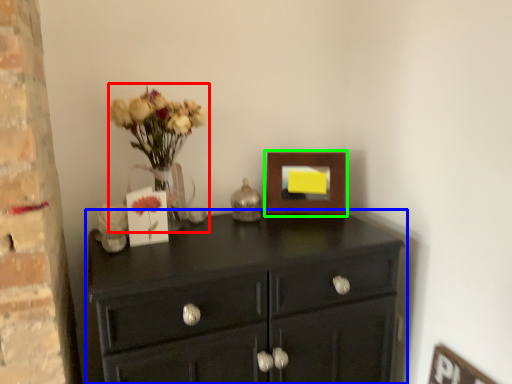
Question: Estimate the real-world distances between objects in this image. Which object is closer to floral arrangement (highlighted by a red box), chest of drawers (highlighted by a blue box) or picture frame (highlighted by a green box)?

Choices:
 (A) chest of drawers
 (B) picture frame

Answer: (A)